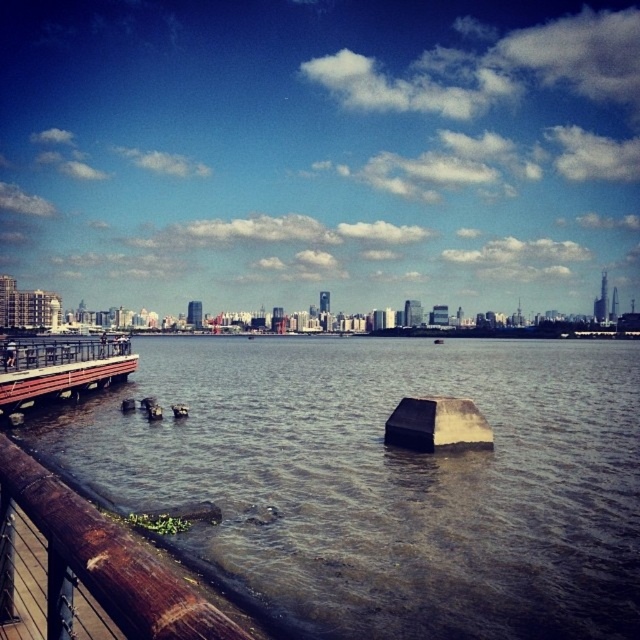
You are standing on the wooden dock at lower left and want to place a small potted plant on the black matte stone at center. Based on their heights, will the potted plant be visible from above when placed there?

The wooden dock at lower left is taller than the black matte stone at center, so when you place the potted plant on the black matte stone at center, it will be lower and might not be visible from above unless you look down.